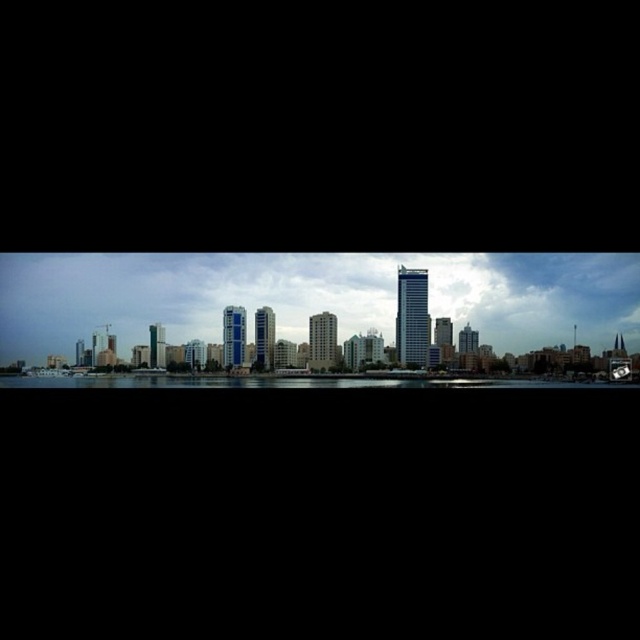
Question: Can you confirm if cloudy sky at center is positioned to the right of transparent glass water at center?

Choices:
 (A) yes
 (B) no

Answer: (A)

Question: Which point is farther to the camera?

Choices:
 (A) transparent glass water at center
 (B) cloudy sky at center

Answer: (B)

Question: Considering the relative positions of cloudy sky at center and transparent glass water at center in the image provided, where is cloudy sky at center located with respect to transparent glass water at center?

Choices:
 (A) left
 (B) right

Answer: (B)

Question: Which object appears farthest from the camera in this image?

Choices:
 (A) cloudy sky at center
 (B) transparent glass water at center

Answer: (A)

Question: Is cloudy sky at center behind transparent glass water at center?

Choices:
 (A) no
 (B) yes

Answer: (B)

Question: Which of the following is the closest to the observer?

Choices:
 (A) (412, 381)
 (B) (81, 288)

Answer: (A)